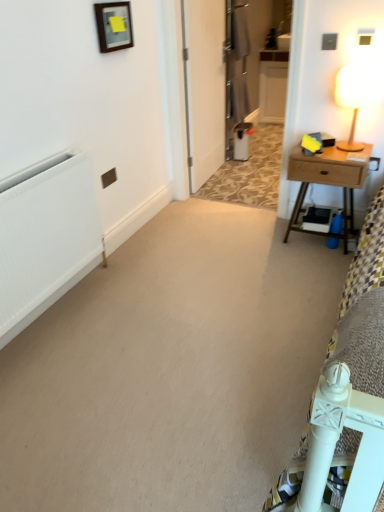
The width and height of the screenshot is (384, 512). I want to click on wooden frame at upper center, so click(x=114, y=26).

The height and width of the screenshot is (512, 384). What are the coordinates of `wooden nightstand at right` in the screenshot? It's located at (327, 181).

Describe the element at coordinates (327, 181) in the screenshot. Image resolution: width=384 pixels, height=512 pixels. I see `wooden nightstand at right` at that location.

What do you see at coordinates (45, 237) in the screenshot? The height and width of the screenshot is (512, 384). I see `white matte radiator at left` at bounding box center [45, 237].

The height and width of the screenshot is (512, 384). Identify the location of metallic gray armoire at center. (236, 69).

At what (x,y) coordinates should I click in order to perform the action: click on wooden frame at upper center. Please return your answer as a coordinate pair (x, y). This screenshot has width=384, height=512. Looking at the image, I should click on (114, 26).

What's the angular difference between white matte radiator at left and wooden table lamp at upper right's facing directions?

The angular difference between white matte radiator at left and wooden table lamp at upper right is 90 degrees.

Based on the photo, from their relative heights in the image, would you say white matte radiator at left is taller or shorter than wooden table lamp at upper right?

In the image, white matte radiator at left appears to be taller than wooden table lamp at upper right.

Can you confirm if white matte radiator at left is bigger than wooden table lamp at upper right?

Correct, white matte radiator at left is larger in size than wooden table lamp at upper right.

Measure the distance between metallic gray armoire at center and wooden table lamp at upper right.

metallic gray armoire at center is 5.88 feet away from wooden table lamp at upper right.

Which object is thinner, metallic gray armoire at center or wooden table lamp at upper right?

metallic gray armoire at center.

Looking at this image, is metallic gray armoire at center facing towards wooden table lamp at upper right?

No, metallic gray armoire at center is not turned towards wooden table lamp at upper right.

Between point (233, 55) and point (381, 88), which one is positioned in front?

The point (381, 88) is in front.

Would you say wooden table lamp at upper right is to the left or to the right of wooden nightstand at right in the picture?

Based on their positions, wooden table lamp at upper right is located to the right of wooden nightstand at right.

Considering the relative sizes of wooden table lamp at upper right and wooden nightstand at right in the image provided, is wooden table lamp at upper right taller than wooden nightstand at right?

No, wooden table lamp at upper right is not taller than wooden nightstand at right.

Is point (357, 85) closer or farther from the camera than point (293, 167)?

Point (357, 85) appears to be closer to the viewer than point (293, 167).

Image resolution: width=384 pixels, height=512 pixels. Identify the location of nightstand that appears behind the wooden table lamp at upper right. (327, 181).

Does point (358, 177) lie behind point (132, 33)?

No, (358, 177) is closer to viewer.

Is wooden frame at upper center surrounded by wooden nightstand at right?

Definitely not — wooden frame at upper center is not inside wooden nightstand at right.

In the image, is wooden nightstand at right positioned in front of or behind wooden frame at upper center?

wooden nightstand at right is positioned farther from the viewer than wooden frame at upper center.

Based on the photo, who is bigger, wooden nightstand at right or wooden frame at upper center?

With larger size is wooden nightstand at right.

Is wooden frame at upper center facing away from metallic gray armoire at center?

That's not correct — wooden frame at upper center is not looking away from metallic gray armoire at center.

From a real-world perspective, is wooden frame at upper center on top of metallic gray armoire at center?

Yes.

From the image's perspective, is wooden frame at upper center located above metallic gray armoire at center?

Actually, wooden frame at upper center appears below metallic gray armoire at center in the image.

Is metallic gray armoire at center surrounded by wooden frame at upper center?

Definitely not — metallic gray armoire at center is not inside wooden frame at upper center.

Measure the distance between white matte radiator at left and metallic gray armoire at center.

A distance of 7.92 feet exists between white matte radiator at left and metallic gray armoire at center.

Which of these two, white matte radiator at left or metallic gray armoire at center, stands shorter?

white matte radiator at left.

Relative to metallic gray armoire at center, is white matte radiator at left in front or behind?

In the image, white matte radiator at left appears in front of metallic gray armoire at center.

Would you say white matte radiator at left is a long distance from metallic gray armoire at center?

white matte radiator at left is positioned a significant distance from metallic gray armoire at center.

Is wooden frame at upper center oriented away from wooden nightstand at right?

No, wooden frame at upper center is not facing away from wooden nightstand at right.

From the picture: From the image's perspective, between wooden frame at upper center and wooden nightstand at right, which one is located above?

wooden frame at upper center appears higher in the image.

Considering the sizes of wooden frame at upper center and wooden nightstand at right in the image, is wooden frame at upper center wider or thinner than wooden nightstand at right?

In the image, wooden frame at upper center appears to be more narrow than wooden nightstand at right.

This screenshot has height=512, width=384. I want to click on table lamp lying behind the white matte radiator at left, so click(359, 92).

Locate an element on the screen. Image resolution: width=384 pixels, height=512 pixels. armoire that appears on the left of wooden table lamp at upper right is located at coordinates (236, 69).

Estimate the real-world distances between objects in this image. Which object is further from white matte radiator at left, wooden frame at upper center or metallic gray armoire at center?

metallic gray armoire at center lies further to white matte radiator at left than the other object.

When comparing their distances from wooden table lamp at upper right, does metallic gray armoire at center or white matte radiator at left seem closer?

The object closer to wooden table lamp at upper right is white matte radiator at left.

From the image, which object appears to be nearer to metallic gray armoire at center, wooden frame at upper center or wooden table lamp at upper right?

Based on the image, wooden frame at upper center appears to be nearer to metallic gray armoire at center.

Based on their spatial positions, is wooden frame at upper center or wooden table lamp at upper right further from white matte radiator at left?

wooden table lamp at upper right is positioned further to the anchor white matte radiator at left.

Considering their positions, is wooden table lamp at upper right positioned closer to wooden nightstand at right than wooden frame at upper center?

Among the two, wooden table lamp at upper right is located nearer to wooden nightstand at right.

Based on their spatial positions, is wooden frame at upper center or wooden table lamp at upper right closer to wooden nightstand at right?

wooden table lamp at upper right is positioned closer to the anchor wooden nightstand at right.

Considering their positions, is wooden nightstand at right positioned further to wooden frame at upper center than white matte radiator at left?

wooden nightstand at right.

From the image, which object appears to be nearer to wooden table lamp at upper right, white matte radiator at left or wooden nightstand at right?

Among the two, wooden nightstand at right is located nearer to wooden table lamp at upper right.

This screenshot has width=384, height=512. What are the coordinates of `nightstand located between wooden table lamp at upper right and metallic gray armoire at center in the depth direction` in the screenshot? It's located at (327, 181).

Where is `table lamp positioned between white matte radiator at left and metallic gray armoire at center from near to far`? table lamp positioned between white matte radiator at left and metallic gray armoire at center from near to far is located at coordinates (359, 92).

You are a GUI agent. You are given a task and a screenshot of the screen. Output one action in this format:
    pyautogui.click(x=<x>, y=<y>)
    Task: Click on the nightstand between wooden frame at upper center and metallic gray armoire at center along the z-axis
    
    Given the screenshot: What is the action you would take?
    pyautogui.click(x=327, y=181)

You are a GUI agent. You are given a task and a screenshot of the screen. Output one action in this format:
    pyautogui.click(x=<x>, y=<y>)
    Task: Click on the nightstand situated between wooden frame at upper center and wooden table lamp at upper right from left to right
    
    Given the screenshot: What is the action you would take?
    pyautogui.click(x=327, y=181)